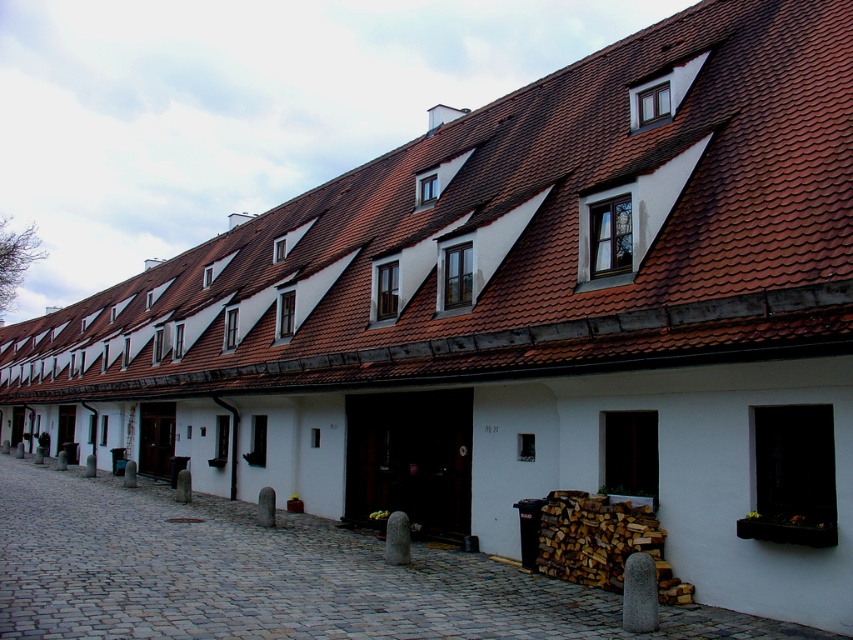
Does brown tile roof at center appear under cobblestone alley at center?

Actually, brown tile roof at center is above cobblestone alley at center.

Describe the element at coordinates (520, 236) in the screenshot. I see `brown tile roof at center` at that location.

Where is `brown tile roof at center`? brown tile roof at center is located at coordinates (520, 236).